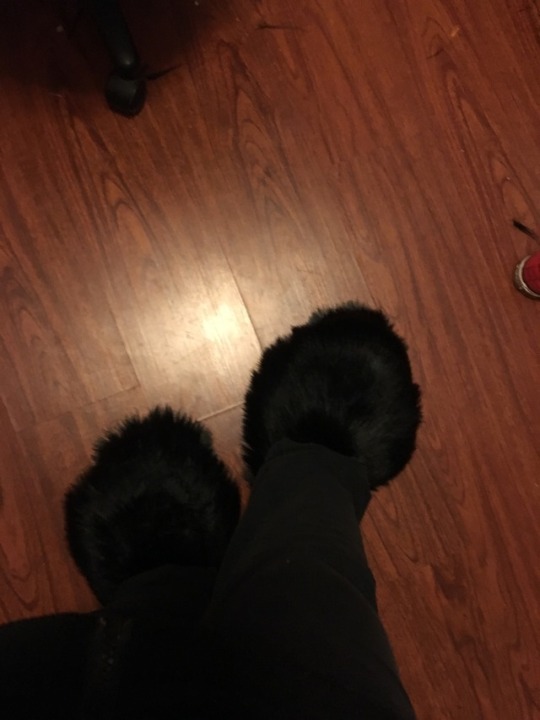
This screenshot has width=540, height=720. I want to click on wood floor, brown, so click(407, 55).